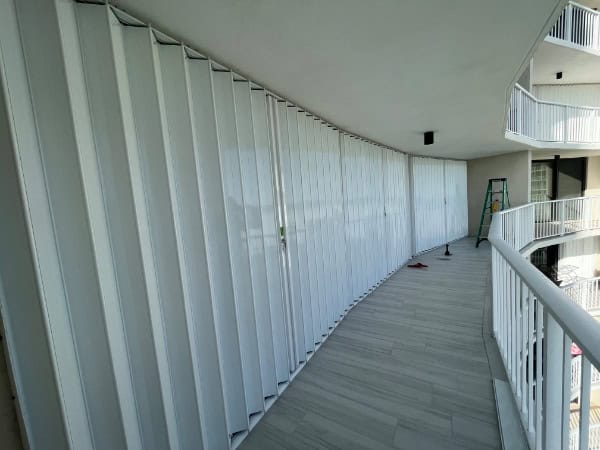
Find the location of a particular element. second floor guardrail is located at coordinates (586, 286).